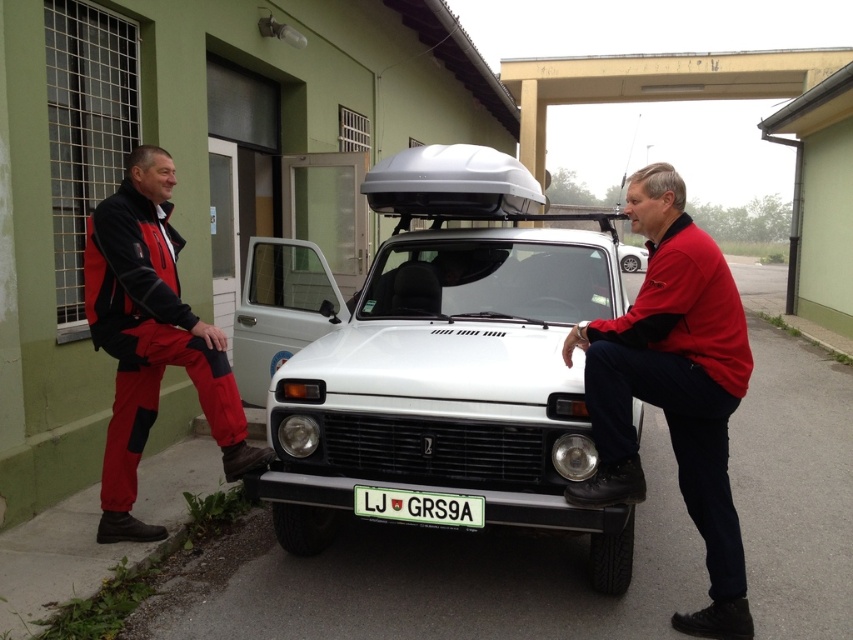
Question: Considering the real-world distances, which object is farthest from the white matte truck at center?

Choices:
 (A) white plastic license plate at center
 (B) red softshell jacket at left
 (C) red matte jacket at center
 (D) white matte car at center

Answer: (D)

Question: Which of the following is the closest to the observer?

Choices:
 (A) (619, 369)
 (B) (628, 253)

Answer: (A)

Question: Does red softshell jacket at left have a greater width compared to white plastic license plate at center?

Choices:
 (A) yes
 (B) no

Answer: (A)

Question: Which object is positioned closest to the red matte jacket at center?

Choices:
 (A) white plastic license plate at center
 (B) white matte car at center

Answer: (A)

Question: From the image, what is the correct spatial relationship of red softshell jacket at left in relation to white plastic license plate at center?

Choices:
 (A) left
 (B) right

Answer: (A)

Question: Does white plastic license plate at center have a larger size compared to white matte car at center?

Choices:
 (A) no
 (B) yes

Answer: (A)